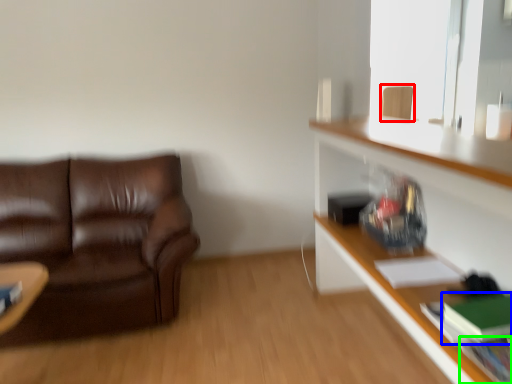
Question: Which object is the closest to the swivel chair (highlighted by a red box)? Choose among these: book (highlighted by a blue box) or book (highlighted by a green box).

Choices:
 (A) book
 (B) book

Answer: (A)